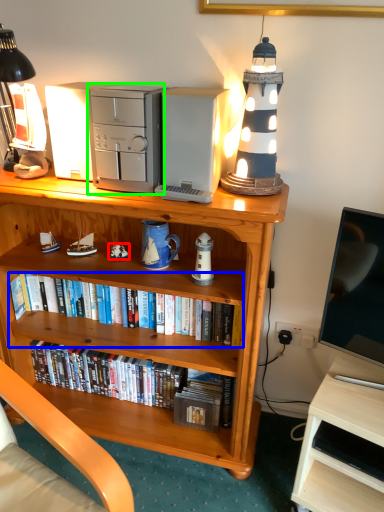
Question: Considering the real-world distances, which object is closest to toy (highlighted by a red box)? book (highlighted by a blue box) or appliance (highlighted by a green box).

Choices:
 (A) book
 (B) appliance

Answer: (A)